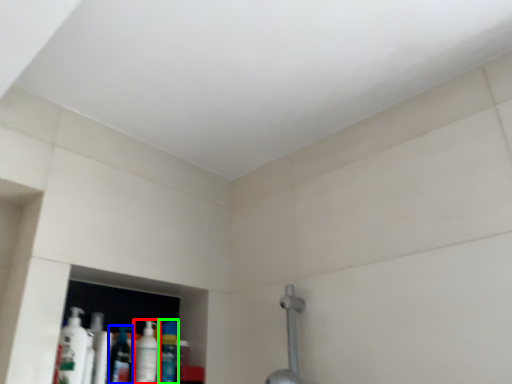
Question: Estimate the real-world distances between objects in this image. Which object is farther from mouthwash (highlighted by a red box), mouthwash (highlighted by a blue box) or mouthwash (highlighted by a green box)?

Choices:
 (A) mouthwash
 (B) mouthwash

Answer: (B)